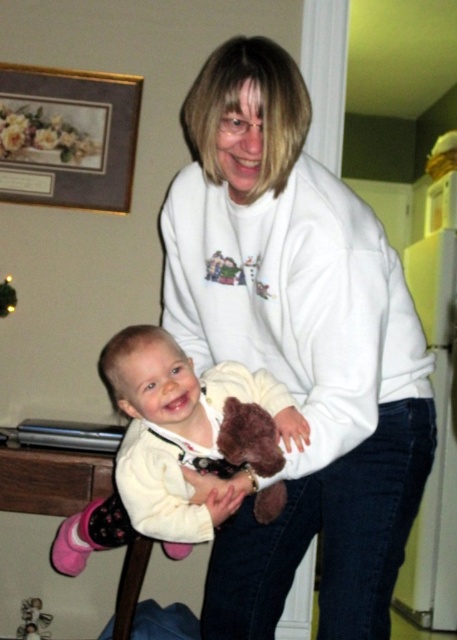
You are a toy organizer who needs to place both the white soft teddy bear at lower left and the soft plush teddy bear at center into a storage box. The box can only fit items up to the size of the smaller teddy bear. Which teddy bear should you leave out?

The white soft teddy bear at lower left is larger than the soft plush teddy bear at center, so you should leave out the white soft teddy bear at lower left.

You are a photographer trying to capture a candid shot of the white fleece sweatshirt at center and the white soft teddy bear at lower left. Which object should you focus on first if you want to include both in the frame without moving the camera?

You should focus on the white fleece sweatshirt at center first because it is much taller than the white soft teddy bear at lower left, so it will occupy more space in the frame and ensure both are visible without needing to adjust the camera position.